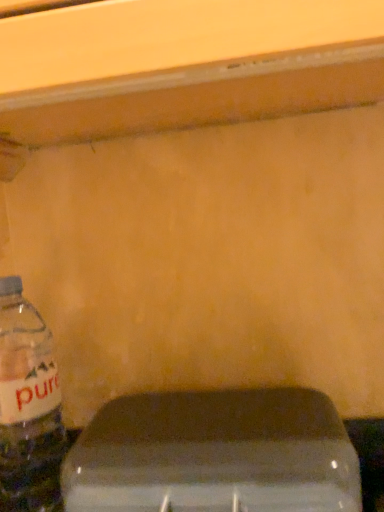
Question: Do you think translucent plastic bottle at left is within transparent plastic water at lower left, or outside of it?

Choices:
 (A) inside
 (B) outside

Answer: (B)

Question: Is translucent plastic bottle at left taller or shorter than transparent plastic water at lower left?

Choices:
 (A) short
 (B) tall

Answer: (B)

Question: Considering the positions of translucent plastic bottle at left and transparent plastic water at lower left in the image, is translucent plastic bottle at left wider or thinner than transparent plastic water at lower left?

Choices:
 (A) thin
 (B) wide

Answer: (A)

Question: Is transparent plastic water at lower left situated inside translucent plastic bottle at left or outside?

Choices:
 (A) inside
 (B) outside

Answer: (B)

Question: From a real-world perspective, is transparent plastic water at lower left above or below translucent plastic bottle at left?

Choices:
 (A) below
 (B) above

Answer: (A)

Question: In terms of width, does transparent plastic water at lower left look wider or thinner when compared to translucent plastic bottle at left?

Choices:
 (A) thin
 (B) wide

Answer: (B)

Question: Is transparent plastic water at lower left in front of or behind translucent plastic bottle at left in the image?

Choices:
 (A) behind
 (B) front

Answer: (B)